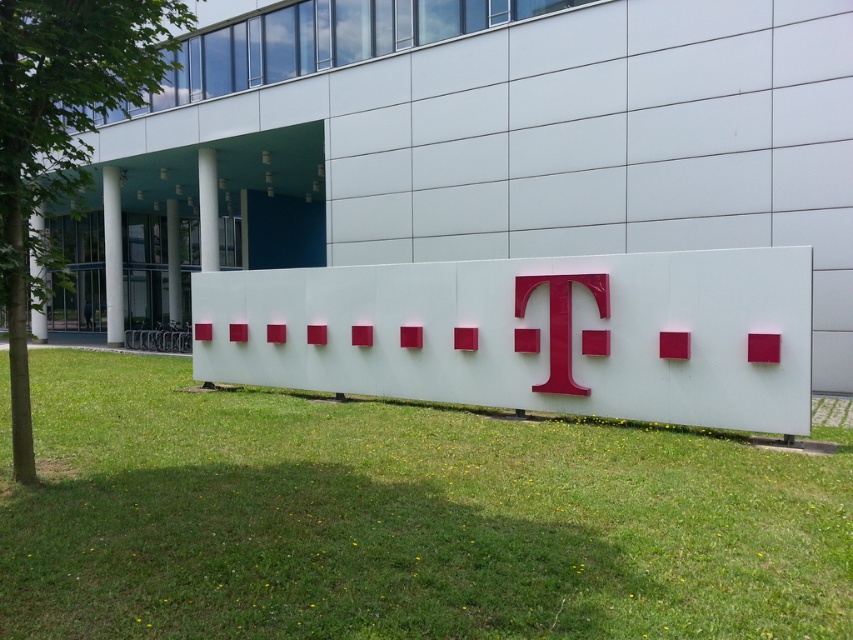
You are standing in front of the building and want to place a new rectangular sign exactly where the green grass at lower center is located. What are the coordinates where you should place the new sign?

The coordinates for placing the new rectangular sign should be at point (399, 518), as that is the 2D location of the green grass at lower center.